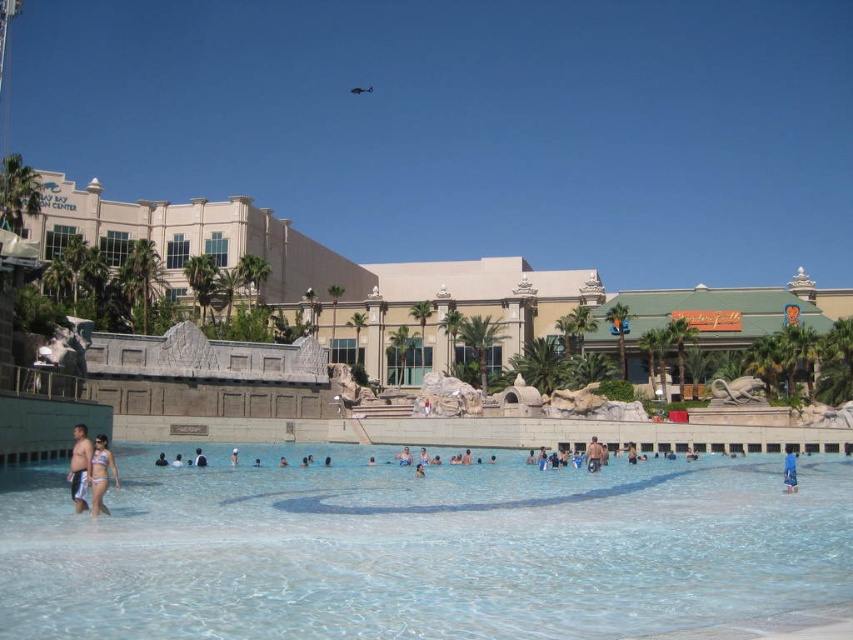
How far apart are matte pink bikini at lower left and tan skin person at center?

The distance of matte pink bikini at lower left from tan skin person at center is 34.07 meters.

Between point (109, 461) and point (589, 451), which one is positioned in front?

Point (109, 461) is in front.

The image size is (853, 640). I want to click on matte pink bikini at lower left, so click(x=102, y=474).

Is light blue swim trunks at left wider than tan skin person at center?

Indeed, light blue swim trunks at left has a greater width compared to tan skin person at center.

Consider the image. Is light blue swim trunks at left to the left of tan skin person at center from the viewer's perspective?

Indeed, light blue swim trunks at left is positioned on the left side of tan skin person at center.

Who is more distant from viewer, (74,502) or (593,452)?

The point (593,452) is more distant.

Where is `light blue swim trunks at left`? light blue swim trunks at left is located at coordinates (79, 467).

Measure the distance between clear glass pool at center and camera.

They are 105.10 feet apart.

Consider the image. Does clear glass pool at center appear on the right side of matte pink bikini at lower left?

Indeed, clear glass pool at center is positioned on the right side of matte pink bikini at lower left.

Between point (399, 518) and point (96, 499), which one is positioned behind?

Positioned behind is point (399, 518).

At what (x,y) coordinates should I click in order to perform the action: click on clear glass pool at center. Please return your answer as a coordinate pair (x, y). Looking at the image, I should click on (422, 550).